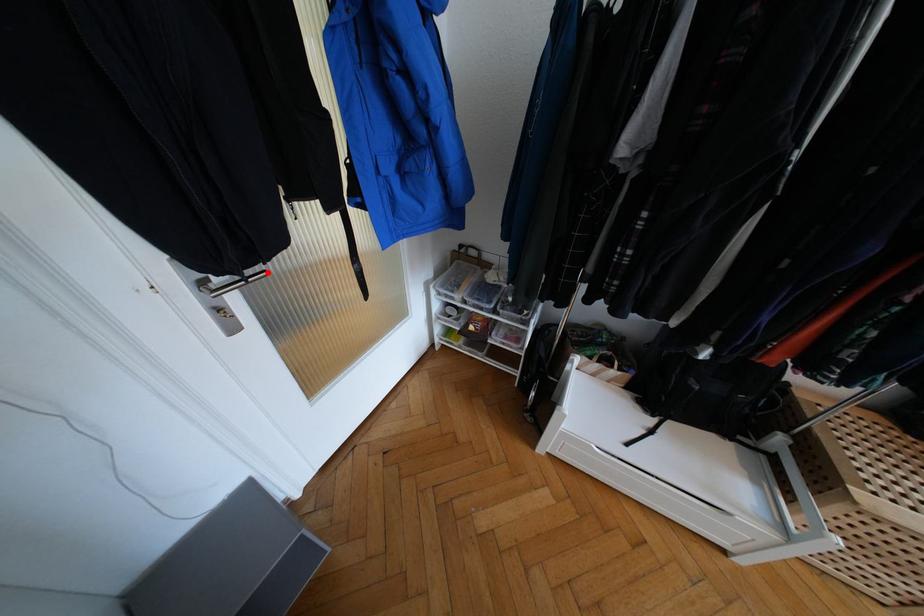
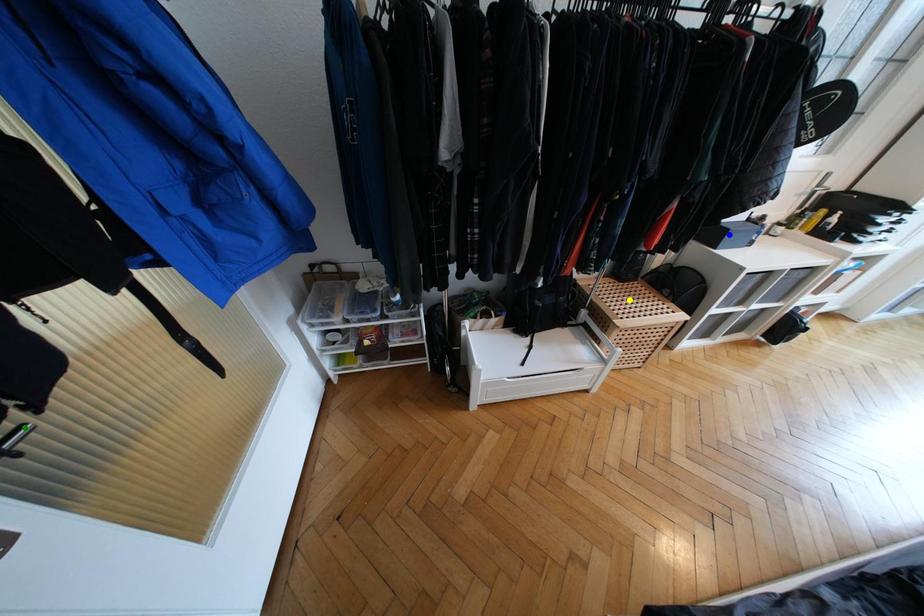
Question: I am providing you with two images of the same scene from different viewpoints. A red point is marked on the first image. You are given multiple points on the second image. Which spot in image 2 lines up with the point in image 1?

Choices:
 (A) blue point
 (B) yellow point
 (C) green point

Answer: (C)